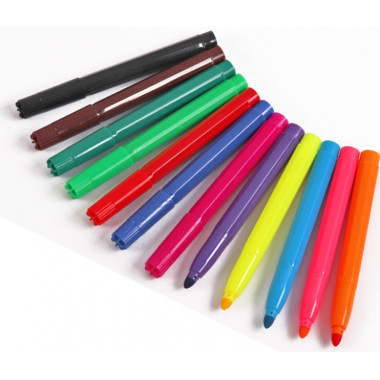
Identify the location of markers with caps. The width and height of the screenshot is (380, 380). (208, 208), (186, 180), (175, 159), (159, 135), (146, 120), (130, 98), (123, 76).